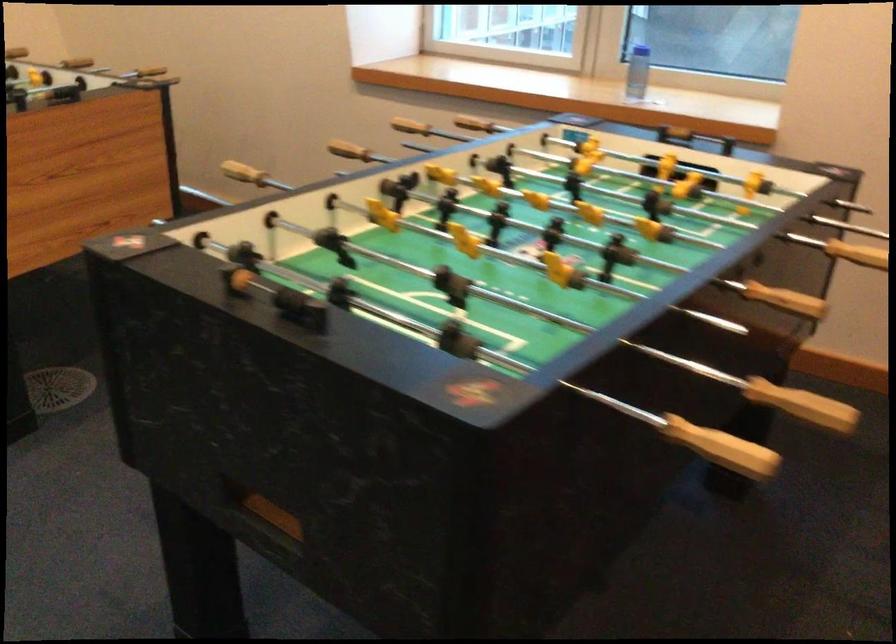
Locate an element on the screen. This screenshot has width=896, height=644. clear water bottle is located at coordinates (636, 73).